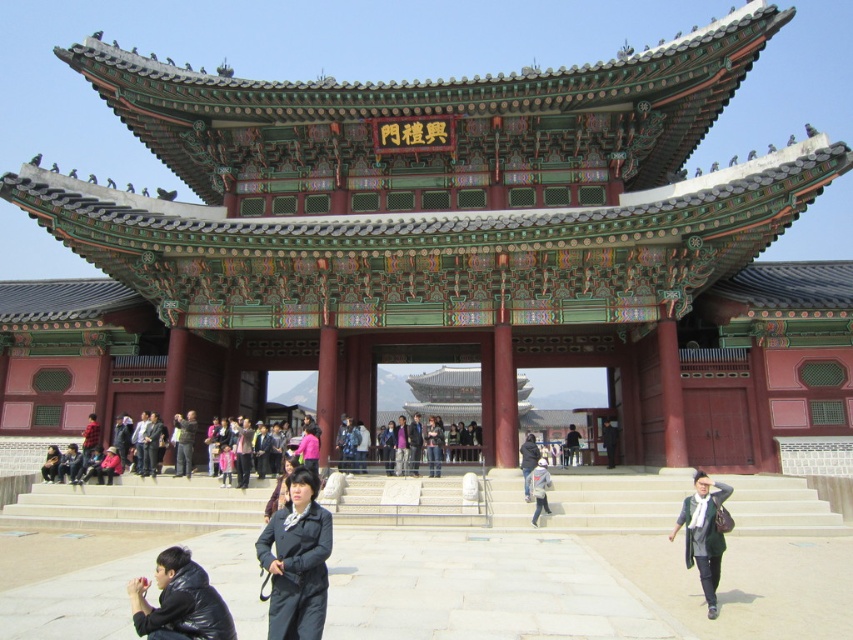
You are a tourist standing in front of the Geunjeongmun Gate at Gyeongbokgung Palace. You notice a black leather jacket at lower left and dark blue jeans at center. Which item is positioned closer to you?

The black leather jacket at lower left is closer to the viewer than the dark blue jeans at center.

You are a photographer planning to take a picture of the Geunjeongmun Gate at Gyeongbokgung Palace. You notice a person wearing a black leather jacket at lower left and dark blue jeans at center in your frame. To ensure the gate is the main focus, which clothing item should you avoid blocking the gate with?

The black leather jacket at lower left is positioned over dark blue jeans at center, so you should avoid blocking the gate with the black leather jacket at lower left as it is closer to the gate and may obstruct the view.